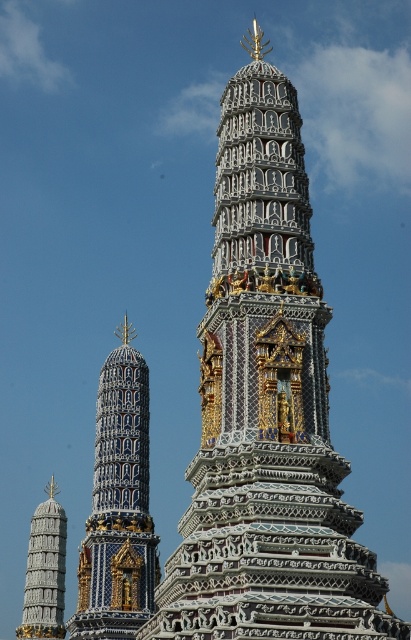
Question: Can you confirm if white glossy temple at center is smaller than white stone tower at lower left?

Choices:
 (A) yes
 (B) no

Answer: (B)

Question: Is blue glazed tiles at left positioned behind white stone tower at lower left?

Choices:
 (A) yes
 (B) no

Answer: (B)

Question: Which object appears closest to the camera in this image?

Choices:
 (A) white glossy temple at center
 (B) white stone tower at lower left
 (C) blue glazed tiles at left

Answer: (A)

Question: Estimate the real-world distances between objects in this image. Which object is closer to the white stone tower at lower left?

Choices:
 (A) white glossy temple at center
 (B) blue glazed tiles at left

Answer: (B)

Question: Among these objects, which one is nearest to the camera?

Choices:
 (A) blue glazed tiles at left
 (B) white glossy temple at center
 (C) white stone tower at lower left

Answer: (B)

Question: Is blue glazed tiles at left to the right of white stone tower at lower left from the viewer's perspective?

Choices:
 (A) yes
 (B) no

Answer: (A)